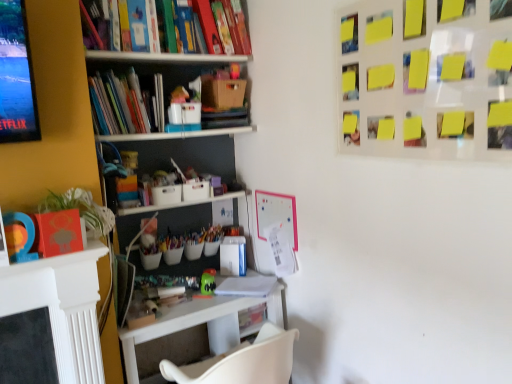
You are a GUI agent. You are given a task and a screenshot of the screen. Output one action in this format:
    pyautogui.click(x=<x>, y=<y>)
    Task: Click on the free space in front of green matte toy at center
    This screenshot has height=384, width=512.
    Given the screenshot: What is the action you would take?
    pyautogui.click(x=212, y=300)